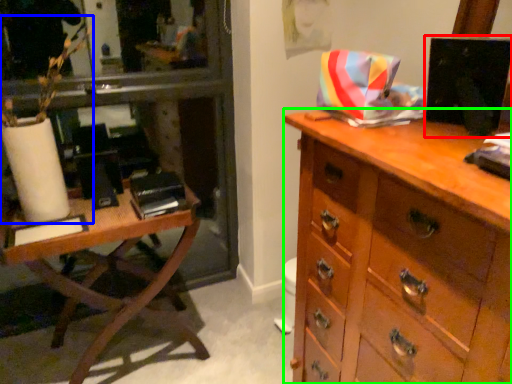
Question: Which object is the farthest from computer monitor (highlighted by a red box)? Choose among these: plant (highlighted by a blue box) or chest of drawers (highlighted by a green box).

Choices:
 (A) plant
 (B) chest of drawers

Answer: (A)